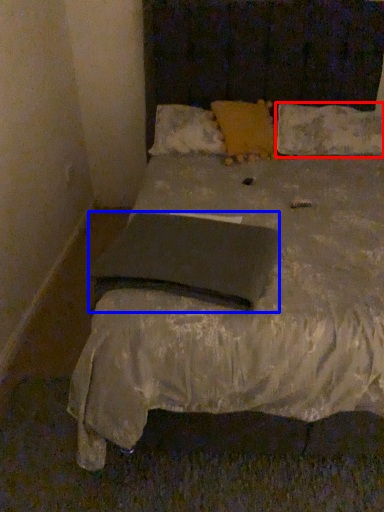
Question: Which object appears closest to the camera in this image, pillow (highlighted by a red box) or pad (highlighted by a blue box)?

Choices:
 (A) pillow
 (B) pad

Answer: (B)